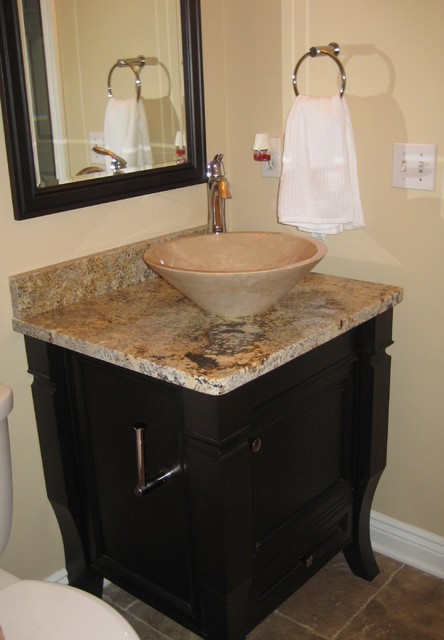
Locate an element on the screen. corner is located at coordinates (284, 51).